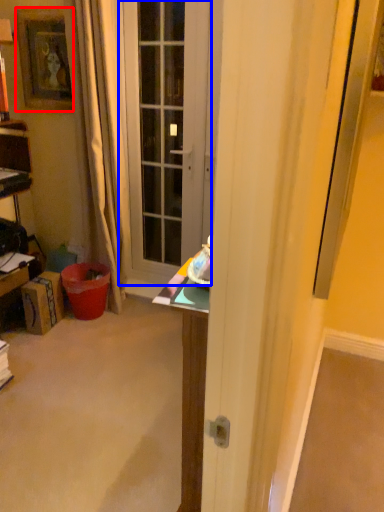
Question: Which object appears farthest to the camera in this image, picture frame (highlighted by a red box) or door (highlighted by a blue box)?

Choices:
 (A) picture frame
 (B) door

Answer: (A)